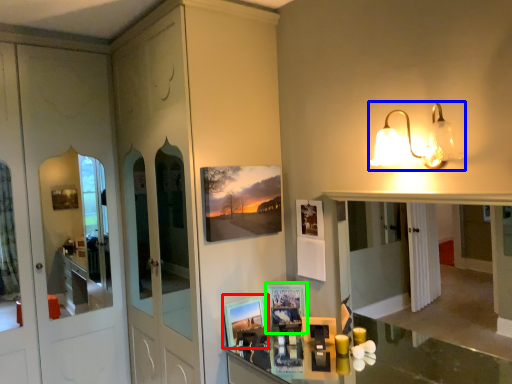
Question: Which object is positioned closest to picture frame (highlighted by a red box)? Select from light fixture (highlighted by a blue box) and picture frame (highlighted by a green box).

Choices:
 (A) light fixture
 (B) picture frame

Answer: (B)